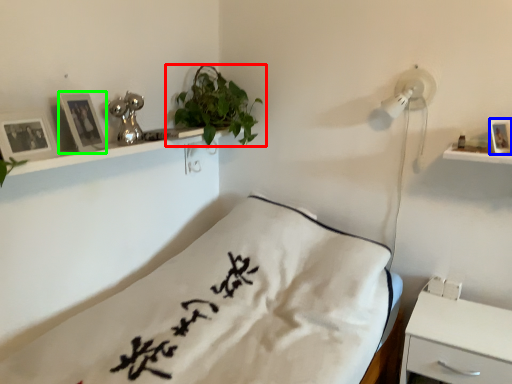
Question: Which object is positioned closest to houseplant (highlighted by a red box)? Select from picture frame (highlighted by a blue box) and picture frame (highlighted by a green box).

Choices:
 (A) picture frame
 (B) picture frame

Answer: (B)